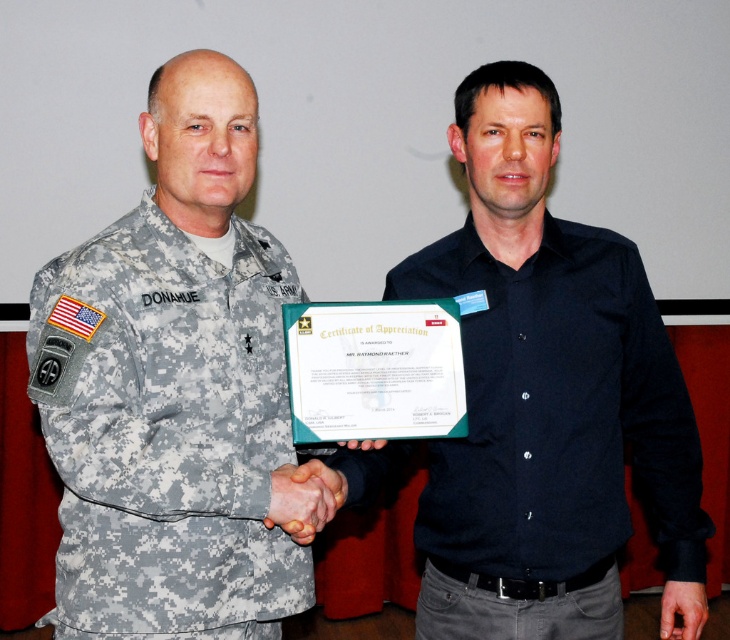
Question: Can you confirm if camouflage fabric uniform at left is positioned above black matte shirt at center?

Choices:
 (A) no
 (B) yes

Answer: (B)

Question: Among these objects, which one is nearest to the camera?

Choices:
 (A) black matte shirt at center
 (B) camouflage fabric uniform at left

Answer: (B)

Question: Among these points, which one is nearest to the camera?

Choices:
 (A) tap(664, 540)
 (B) tap(128, 252)

Answer: (B)

Question: Does camouflage fabric uniform at left come behind black matte shirt at center?

Choices:
 (A) yes
 (B) no

Answer: (B)

Question: Can you confirm if camouflage fabric uniform at left is thinner than black matte shirt at center?

Choices:
 (A) yes
 (B) no

Answer: (A)